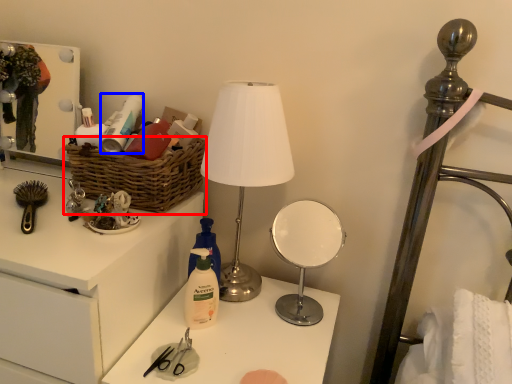
Question: Which object appears closest to the camera in this image, basket (highlighted by a red box) or toiletry (highlighted by a blue box)?

Choices:
 (A) basket
 (B) toiletry

Answer: (A)